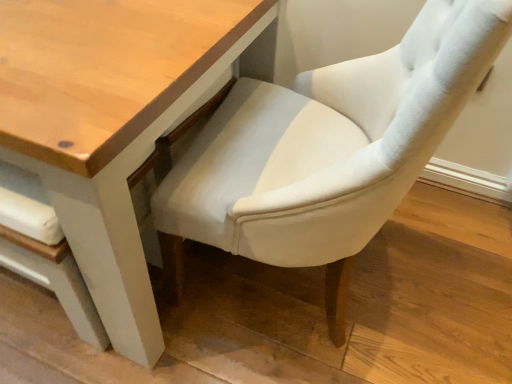
Question: From the image's perspective, is wooden table at center located above or below light gray fabric chair at center?

Choices:
 (A) above
 (B) below

Answer: (A)

Question: From a real-world perspective, is wooden table at center above or below light gray fabric chair at center?

Choices:
 (A) below
 (B) above

Answer: (A)

Question: Is wooden table at center inside or outside of light gray fabric chair at center?

Choices:
 (A) outside
 (B) inside

Answer: (A)

Question: Considering their positions, is light gray fabric chair at center located in front of or behind wooden table at center?

Choices:
 (A) behind
 (B) front

Answer: (B)

Question: From a real-world perspective, is light gray fabric chair at center above or below wooden table at center?

Choices:
 (A) below
 (B) above

Answer: (B)

Question: Is light gray fabric chair at center wider or thinner than wooden table at center?

Choices:
 (A) wide
 (B) thin

Answer: (B)

Question: Is point (379, 66) closer or farther from the camera than point (96, 122)?

Choices:
 (A) closer
 (B) farther

Answer: (B)